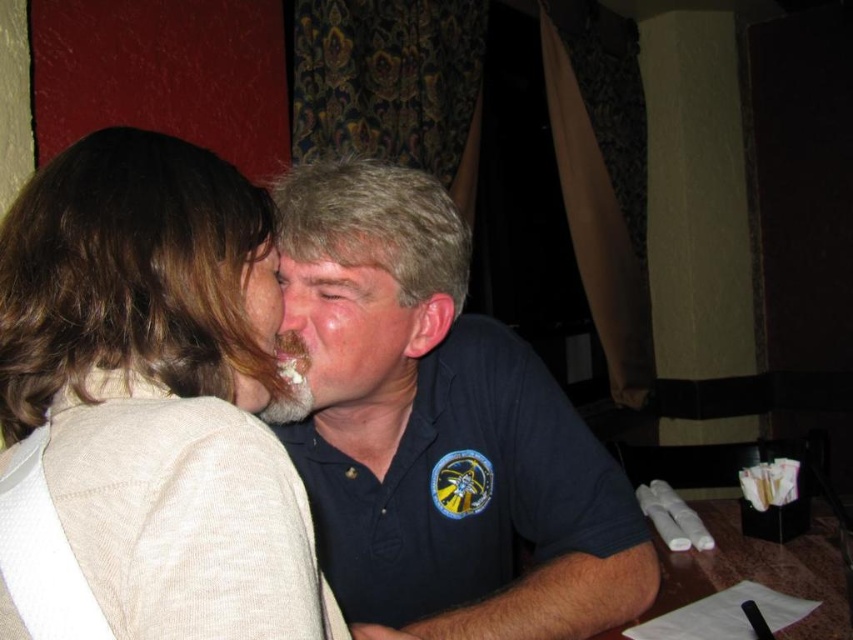
Question: Does beige matte face at center appear under matte skin face at center?

Choices:
 (A) yes
 (B) no

Answer: (A)

Question: Is light beige sweater at upper left to the right of beige matte face at center from the viewer's perspective?

Choices:
 (A) no
 (B) yes

Answer: (A)

Question: Estimate the real-world distances between objects in this image. Which object is farther from the matte skin face at center?

Choices:
 (A) light beige sweater at upper left
 (B) beige matte face at center

Answer: (B)

Question: Which is farther from the smooth skin forehead at center?

Choices:
 (A) beige matte face at center
 (B) light beige sweater at upper left
 (C) matte skin face at center

Answer: (B)

Question: Which object appears closest to the camera in this image?

Choices:
 (A) light beige sweater at upper left
 (B) beige matte face at center

Answer: (A)

Question: Does light beige sweater at upper left have a smaller size compared to smooth skin forehead at center?

Choices:
 (A) no
 (B) yes

Answer: (A)